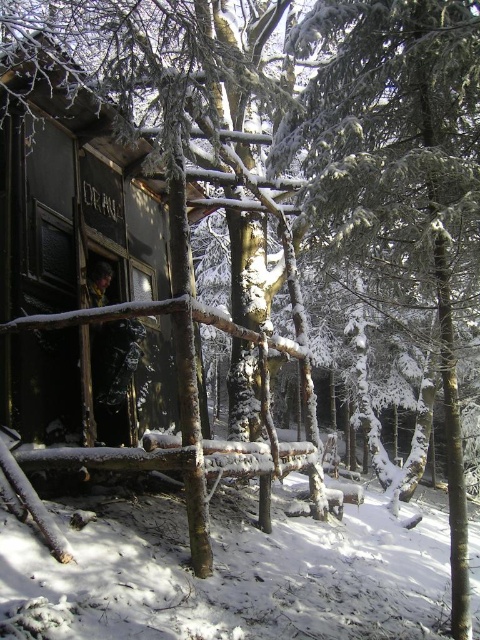
You are an explorer in a snowy forest and see the black wooden cabin at left and the white fluffy snow at lower left. Which object is closer to you?

The white fluffy snow at lower left is closer because it is positioned under the black wooden cabin at left, indicating it is in front.

You are navigating through the winter forest and come across the scene. You need to reach the black wooden cabin at left. Given the coordinates provided in the Objects Description, can you determine the direction you should head from your current position at the center of the image?

The black wooden cabin at left is located at coordinates point (71, 193). Since your current position is at the center of the image, you should head towards the left and slightly downward to reach the black wooden cabin at left.